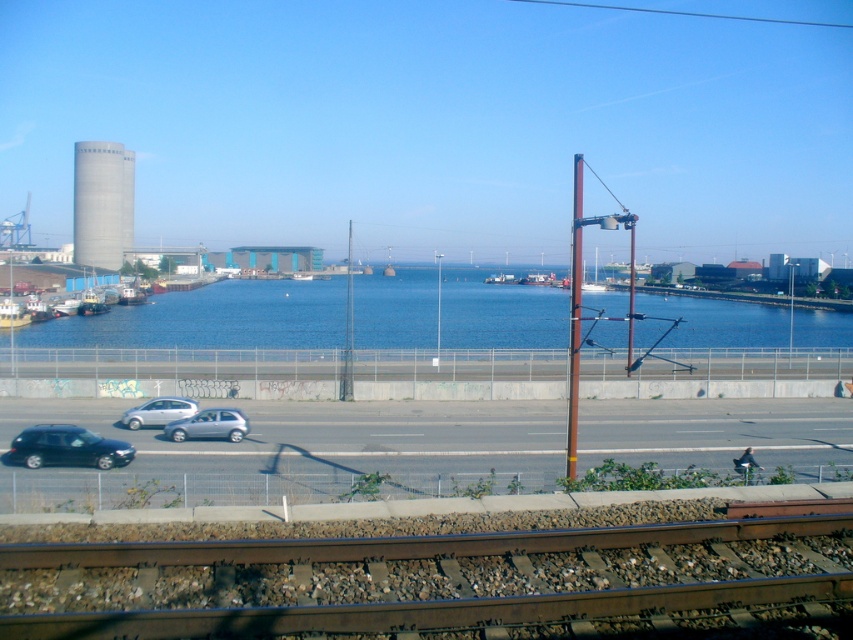
You are a delivery drone with a maximum flight range of 350 feet. You need to deliver a package from the gray concrete water tower at left to the satin silver hatchback at lower center. Can you complete the delivery without needing to recharge?

The distance between the gray concrete water tower at left and the satin silver hatchback at lower center is 360.51 feet. Since this exceeds the drone s 350 feet range, the drone cannot complete the delivery without recharging.

You are standing on the railway track and want to go to the blue water at center. Which direction should you walk relative to the gray concrete water tower at left?

The blue water at center is to the right of the gray concrete water tower at left, so you should walk to the right of the gray concrete water tower at left to reach the blue water at center.